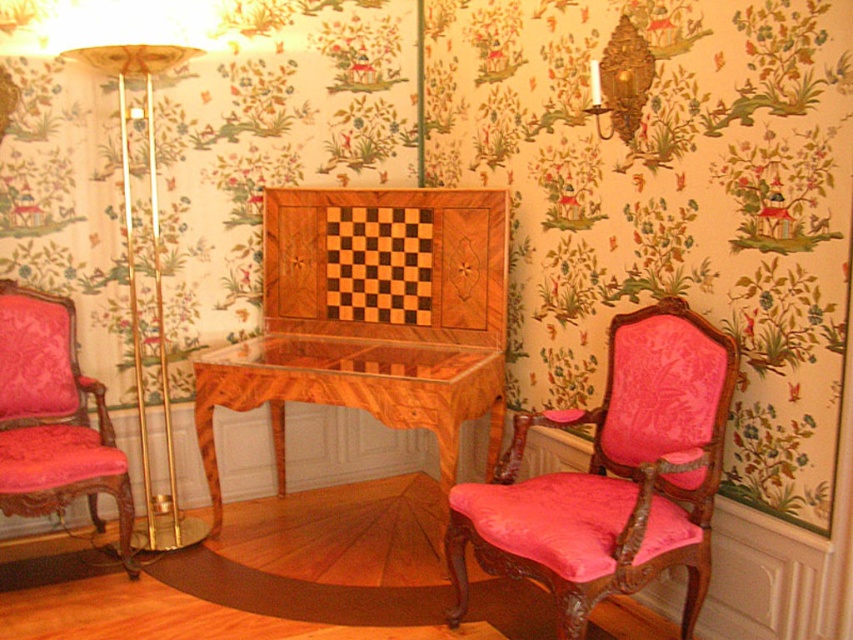
Question: Which object is positioned closest to the gold metallic floor lamp at left?

Choices:
 (A) wooden table at center
 (B) velvet pink armchair at left

Answer: (B)

Question: Is pink velvet armchair at right to the left of velvet pink armchair at left from the viewer's perspective?

Choices:
 (A) yes
 (B) no

Answer: (B)

Question: Can you confirm if pink velvet armchair at right is positioned above wooden table at center?

Choices:
 (A) yes
 (B) no

Answer: (B)

Question: Is velvet pink armchair at left thinner than gold metallic floor lamp at left?

Choices:
 (A) yes
 (B) no

Answer: (B)

Question: Among these points, which one is nearest to the camera?

Choices:
 (A) (267, 355)
 (B) (26, 451)

Answer: (B)

Question: Which object appears closest to the camera in this image?

Choices:
 (A) gold metallic floor lamp at left
 (B) pink velvet armchair at right
 (C) velvet pink armchair at left
 (D) wooden table at center

Answer: (B)